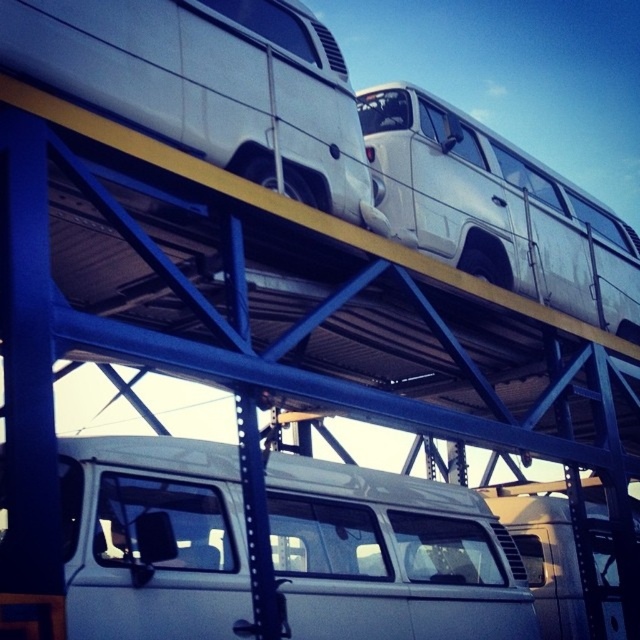
Question: Is white matte van at center to the right of white metallic van at upper center from the viewer's perspective?

Choices:
 (A) no
 (B) yes

Answer: (A)

Question: Does white matte van at center appear on the left side of white matte van at upper center?

Choices:
 (A) no
 (B) yes

Answer: (B)

Question: Does white matte van at upper center appear on the right side of white metallic van at upper center?

Choices:
 (A) yes
 (B) no

Answer: (B)

Question: Which object appears closest to the camera in this image?

Choices:
 (A) white matte van at center
 (B) white matte van at upper center
 (C) white metallic van at upper center

Answer: (A)

Question: Which object is positioned farthest from the white matte van at upper center?

Choices:
 (A) white matte van at center
 (B) white metallic van at upper center

Answer: (B)

Question: Among these objects, which one is nearest to the camera?

Choices:
 (A) white matte van at upper center
 (B) white metallic van at upper center
 (C) white matte van at center

Answer: (C)